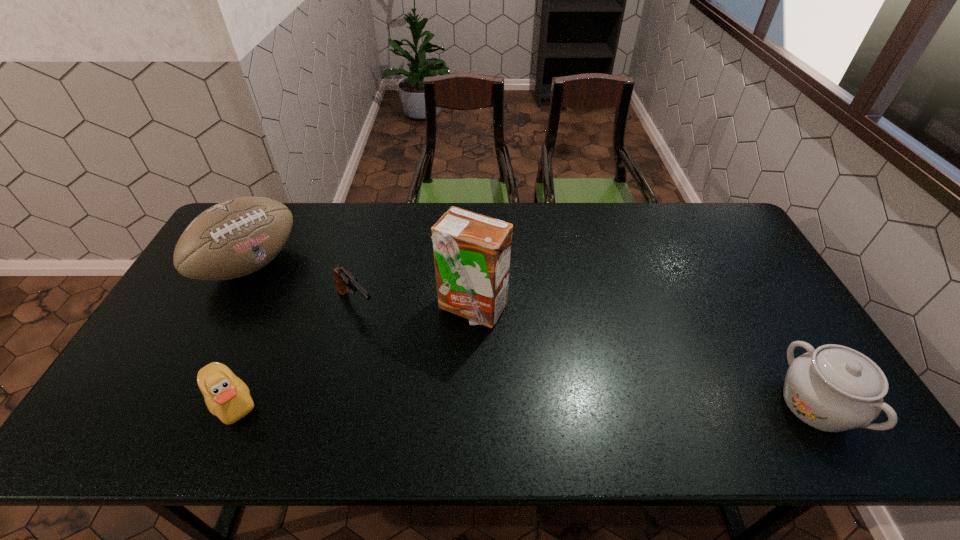
Where is `vacant area in the image that satisfies the following two spatial constraints: 1. on the front side of the carton; 2. on the left side of the fourth shortest object`? This screenshot has height=540, width=960. vacant area in the image that satisfies the following two spatial constraints: 1. on the front side of the carton; 2. on the left side of the fourth shortest object is located at coordinates (228, 307).